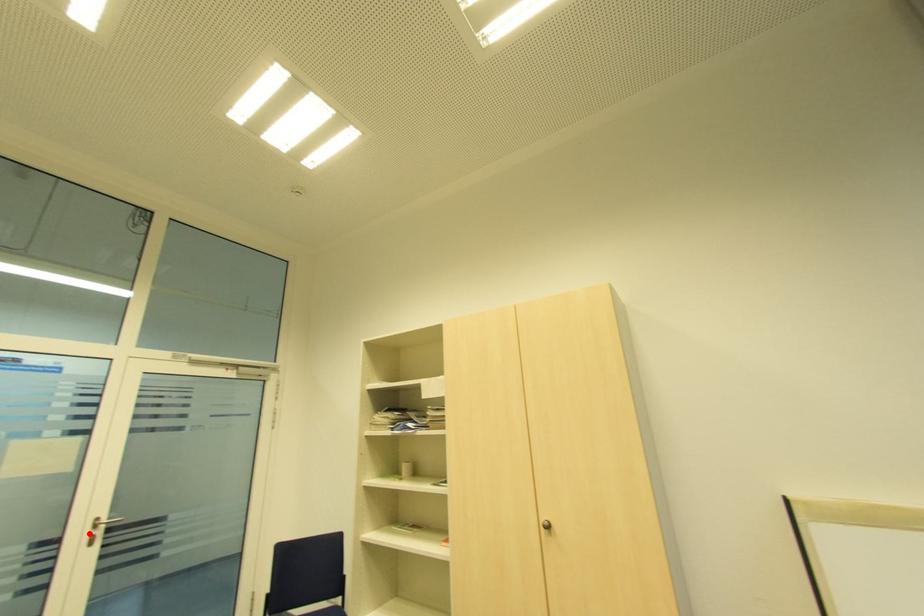
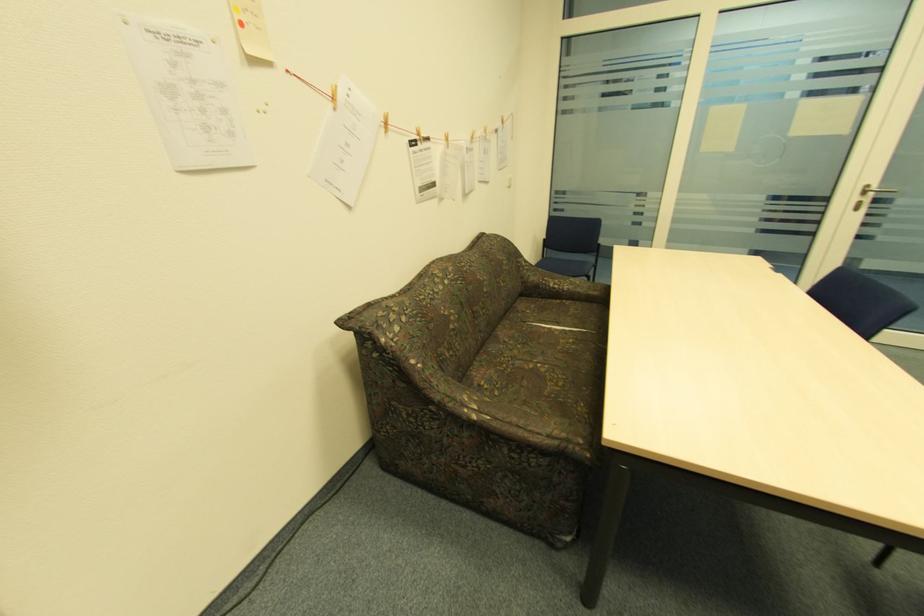
Where in the second image is the point corresponding to the highlighted location from the first image?

(859, 199)